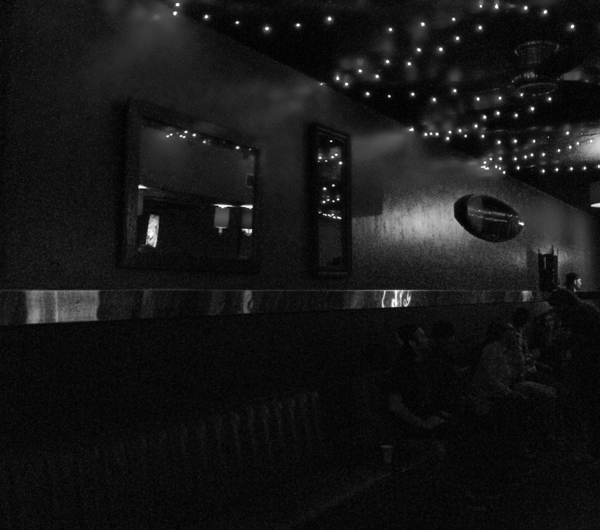
The image size is (600, 530). Find the location of `shiny chair rail`. shiny chair rail is located at coordinates (402, 301).